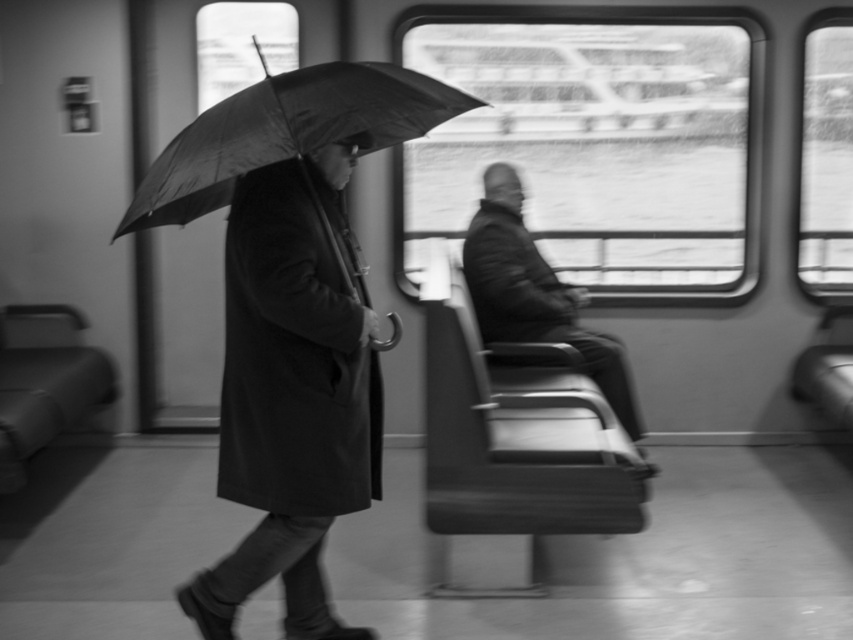
Question: Which point is closer to the camera taking this photo?

Choices:
 (A) (595, 352)
 (B) (300, 260)
 (C) (386, 122)

Answer: (C)

Question: Is matte black umbrella at left bigger than black matte umbrella at left?

Choices:
 (A) no
 (B) yes

Answer: (B)

Question: Which object is farther from the camera taking this photo?

Choices:
 (A) black matte umbrella at left
 (B) coated black jacket at center

Answer: (B)

Question: Is black matte umbrella at left to the right of coated black jacket at center from the viewer's perspective?

Choices:
 (A) no
 (B) yes

Answer: (A)

Question: Can you confirm if matte black umbrella at left is smaller than coated black jacket at center?

Choices:
 (A) yes
 (B) no

Answer: (B)

Question: Estimate the real-world distances between objects in this image. Which object is farther from the matte black umbrella at left?

Choices:
 (A) coated black jacket at center
 (B) black matte umbrella at left

Answer: (A)